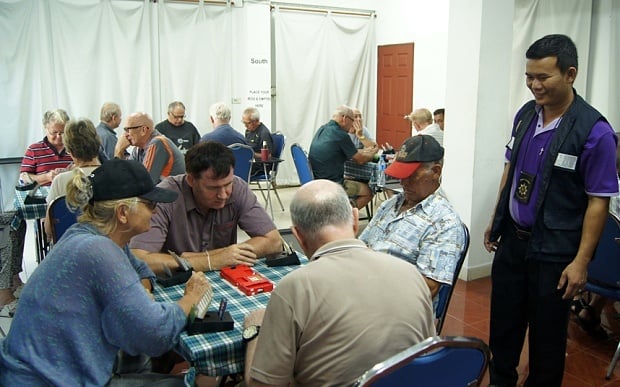
Image resolution: width=620 pixels, height=387 pixels. I want to click on floor, so click(x=469, y=308).